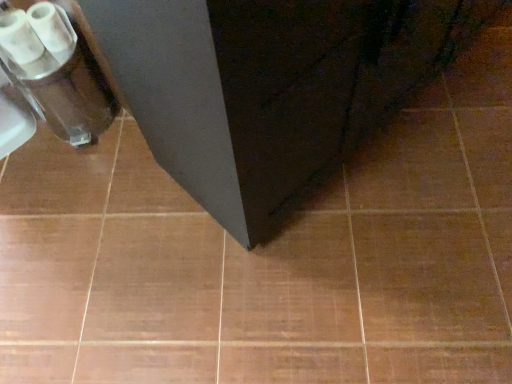
Question: In terms of size, does matte black cabinet at center appear bigger or smaller than white glossy toilet paper at upper left?

Choices:
 (A) small
 (B) big

Answer: (B)

Question: In the image, is matte black cabinet at center positioned in front of or behind white glossy toilet paper at upper left?

Choices:
 (A) behind
 (B) front

Answer: (B)

Question: From a real-world perspective, relative to white glossy toilet paper at upper left, is matte black cabinet at center vertically above or below?

Choices:
 (A) above
 (B) below

Answer: (A)

Question: From the image's perspective, is white glossy toilet paper at upper left above or below matte black cabinet at center?

Choices:
 (A) above
 (B) below

Answer: (B)

Question: Is white glossy toilet paper at upper left to the left or to the right of matte black cabinet at center in the image?

Choices:
 (A) left
 (B) right

Answer: (A)

Question: Based on their sizes in the image, would you say white glossy toilet paper at upper left is bigger or smaller than matte black cabinet at center?

Choices:
 (A) big
 (B) small

Answer: (B)

Question: Is white glossy toilet paper at upper left in front of or behind matte black cabinet at center in the image?

Choices:
 (A) front
 (B) behind

Answer: (B)